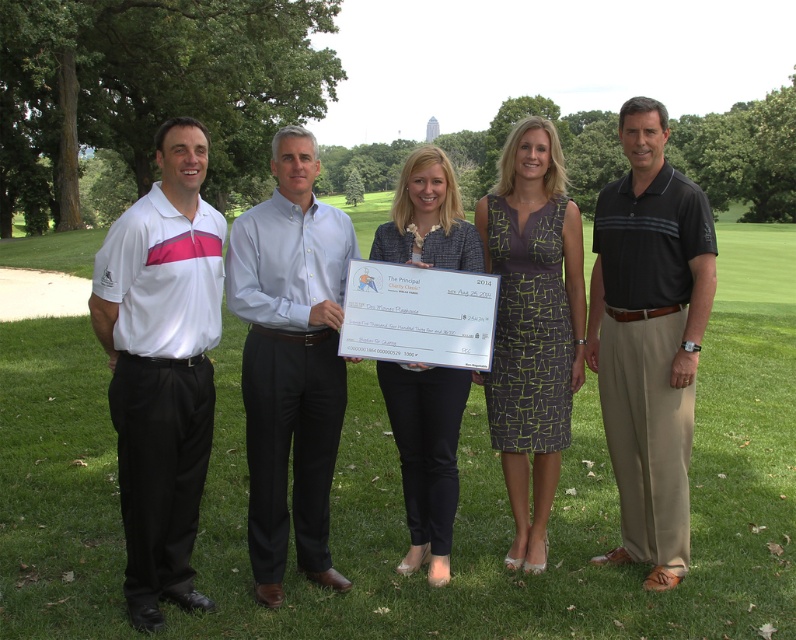
Does dark brown striped polo shirt at center have a greater height compared to light blue shirt at center?

Indeed, dark brown striped polo shirt at center has a greater height compared to light blue shirt at center.

Between dark brown striped polo shirt at center and light blue shirt at center, which one is positioned higher?

Positioned higher is dark brown striped polo shirt at center.

Image resolution: width=796 pixels, height=640 pixels. I want to click on dark brown striped polo shirt at center, so click(650, 339).

Locate an element on the screen. The height and width of the screenshot is (640, 796). dark brown striped polo shirt at center is located at coordinates (650, 339).

Between white smooth polo shirt at left and printed fabric dress at center, which one has less height?

With less height is white smooth polo shirt at left.

In the scene shown: Can you confirm if white smooth polo shirt at left is shorter than printed fabric dress at center?

Correct, white smooth polo shirt at left is not as tall as printed fabric dress at center.

Describe the element at coordinates (162, 365) in the screenshot. The image size is (796, 640). I see `white smooth polo shirt at left` at that location.

At what (x,y) coordinates should I click in order to perform the action: click on white smooth polo shirt at left. Please return your answer as a coordinate pair (x, y). This screenshot has width=796, height=640. Looking at the image, I should click on (162, 365).

Is white smooth polo shirt at left above dark brown striped polo shirt at center?

Answer: No.

Between point (119, 227) and point (681, 262), which one is positioned behind?

Point (681, 262)

Is point (153, 534) positioned behind point (650, 513)?

No.

At what (x,y) coordinates should I click in order to perform the action: click on white smooth polo shirt at left. Please return your answer as a coordinate pair (x, y). This screenshot has height=640, width=796. Looking at the image, I should click on (162, 365).